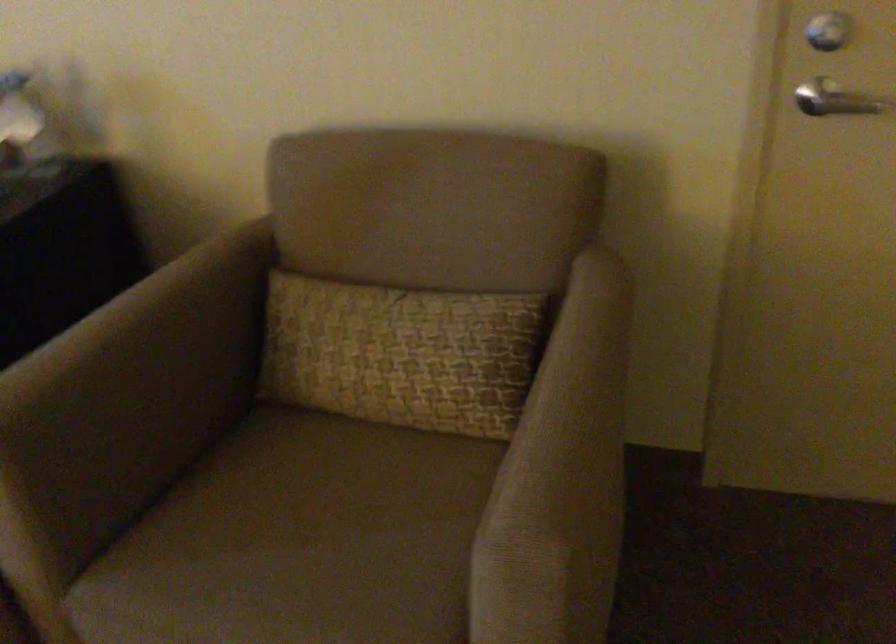
I want to click on silver door handle, so click(840, 102).